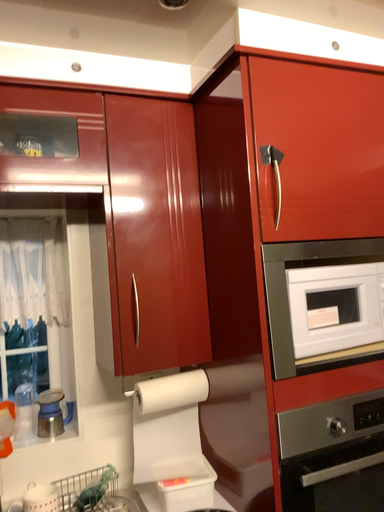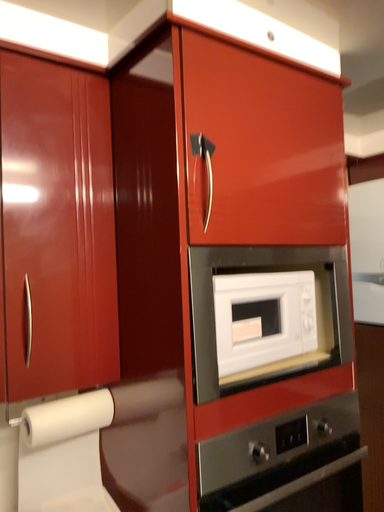
Question: Which way did the camera rotate in the video?

Choices:
 (A) rotated left
 (B) rotated right

Answer: (B)